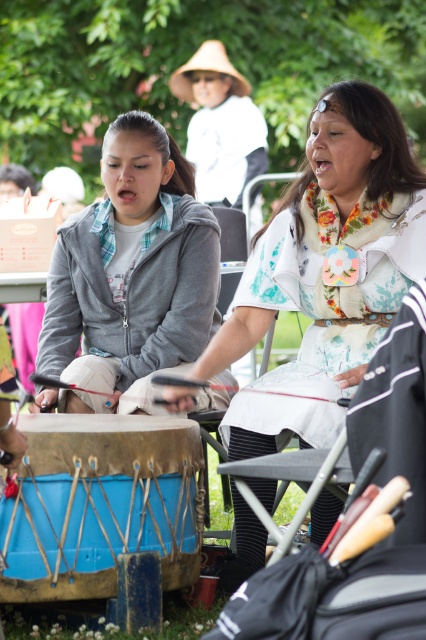
Question: Does gray fleece jacket at center come in front of blue leather drum at lower left?

Choices:
 (A) yes
 (B) no

Answer: (B)

Question: Does matte white dress at center appear on the right side of gray fleece jacket at center?

Choices:
 (A) no
 (B) yes

Answer: (B)

Question: Is matte white dress at center wider than blue leather drum at lower left?

Choices:
 (A) no
 (B) yes

Answer: (B)

Question: Estimate the real-world distances between objects in this image. Which object is farther from the gray fleece jacket at center?

Choices:
 (A) blue leather drum at lower left
 (B) matte white dress at center

Answer: (A)

Question: Which point is farther to the camera?

Choices:
 (A) gray fleece jacket at center
 (B) blue leather drum at lower left

Answer: (A)

Question: Which point is closer to the camera?

Choices:
 (A) matte white dress at center
 (B) gray fleece jacket at center
 (C) blue leather drum at lower left

Answer: (C)